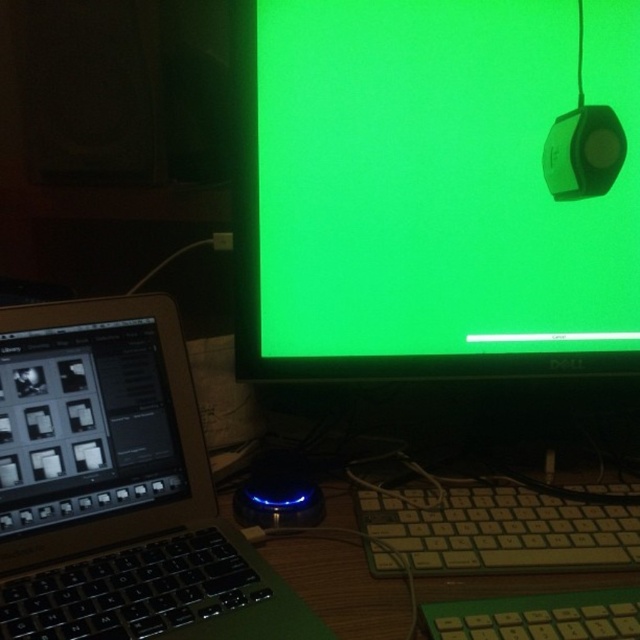
Which of these two, white plastic keyboard at lower center or blue led mouse at center, stands shorter?

With less height is white plastic keyboard at lower center.

Describe the element at coordinates (502, 531) in the screenshot. I see `white plastic keyboard at lower center` at that location.

Where is `white plastic keyboard at lower center`? This screenshot has height=640, width=640. white plastic keyboard at lower center is located at coordinates (502, 531).

Locate an element on the screen. This screenshot has width=640, height=640. white plastic keyboard at lower center is located at coordinates (502, 531).

Which is more to the right, black matte screen at lower left or blue led mouse at center?

blue led mouse at center

Between black matte screen at lower left and blue led mouse at center, which one appears on the left side from the viewer's perspective?

Positioned to the left is black matte screen at lower left.

At what (x,y) coordinates should I click in order to perform the action: click on black matte screen at lower left. Please return your answer as a coordinate pair (x, y). The height and width of the screenshot is (640, 640). Looking at the image, I should click on (84, 422).

Is point (92, 444) less distant than point (140, 417)?

Yes, point (92, 444) is closer to viewer.

Is point (196, 426) farther from viewer compared to point (54, 346)?

Yes.

Is point (156, 300) closer to viewer compared to point (10, 436)?

No, (156, 300) is behind (10, 436).

Image resolution: width=640 pixels, height=640 pixels. In order to click on satin black laptop at left in this screenshot , I will do `click(118, 486)`.